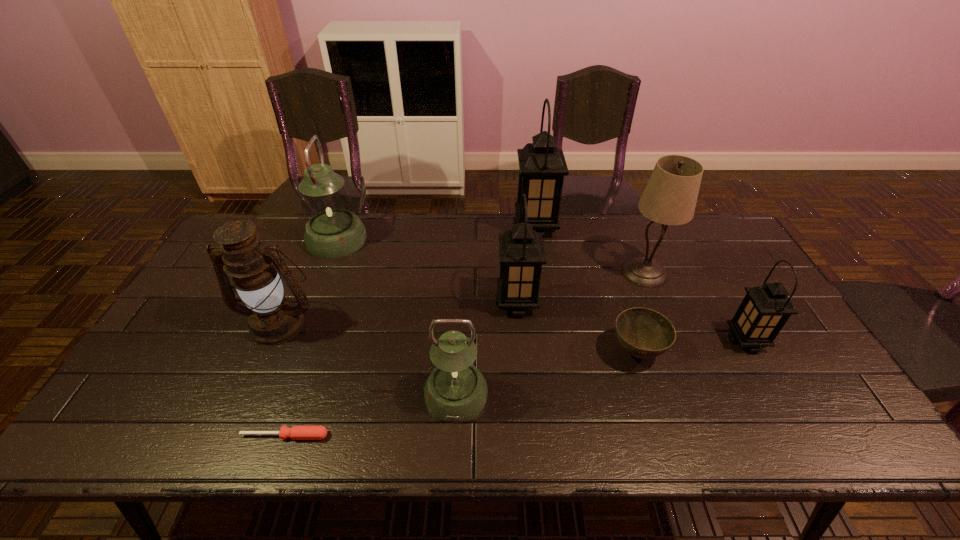
Locate an element on the screen. the smaller greenish lantern is located at coordinates (456, 391).

The width and height of the screenshot is (960, 540). I want to click on the right greenish lantern, so click(456, 391).

The height and width of the screenshot is (540, 960). I want to click on brown bowl, so click(643, 333).

The width and height of the screenshot is (960, 540). I want to click on the second shortest object, so click(x=643, y=333).

Image resolution: width=960 pixels, height=540 pixels. What are the coordinates of `red screwdriver` in the screenshot? It's located at (296, 432).

Find the location of a particular element. This screenshot has height=540, width=960. the nearest object is located at coordinates (296, 432).

Image resolution: width=960 pixels, height=540 pixels. Identify the location of blank space located 0.080m on the right of the biggest black lantern. (580, 228).

What are the coordinates of `free region located 0.310m on the front-facing side of the lampshade` in the screenshot? It's located at (522, 273).

Image resolution: width=960 pixels, height=540 pixels. I want to click on vacant point located on the front-facing side of the lampshade, so click(x=586, y=273).

At what (x,y) coordinates should I click in order to perform the action: click on free region located on the front-facing side of the lampshade. Please return your answer as a coordinate pair (x, y). This screenshot has height=540, width=960. Looking at the image, I should click on (506, 273).